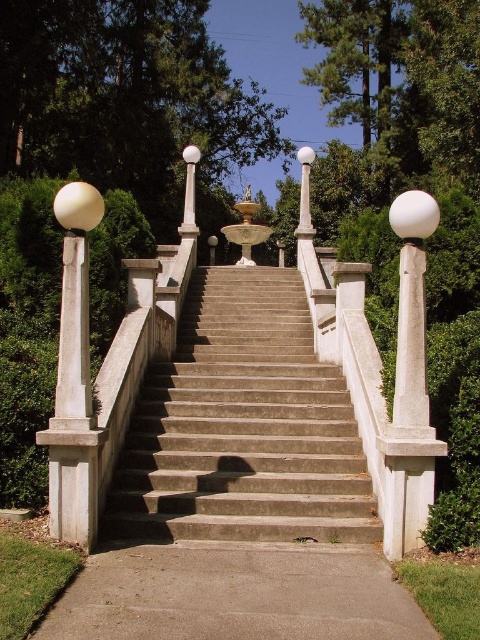
In the scene shown: You are a delivery person carrying a heavy box and need to move from the gray concrete sidewalk at lower center to the concrete stairs at center. Considering their heights, which one is higher and requires more effort to climb?

The concrete stairs at center has a greater height compared to the gray concrete sidewalk at lower center, so the concrete stairs at center is higher and requires more effort to climb.

You are standing at the bottom of the staircase and want to walk to the fountain. Which path should you take, the concrete stairs at center or the gray concrete sidewalk at lower center?

The concrete stairs at center is positioned on the left side of gray concrete sidewalk at lower center, so to reach the fountain at the top of the staircase, you should take the concrete stairs at center as it leads upward towards the fountain.

You are standing at the base of the grand staircase and want to reach the fountain at the top. If your walking speed is 1.2 meters per second, approximately how many seconds will it take you to reach the fountain from the concrete stairs at center?

The concrete stairs at center is 11.46 meters away from viewer. At a walking speed of 1.2 meters per second, it will take approximately 9.55 seconds to reach the fountain. Since the question asks for an approximate value, rounding to the nearest whole number gives about 10 seconds.